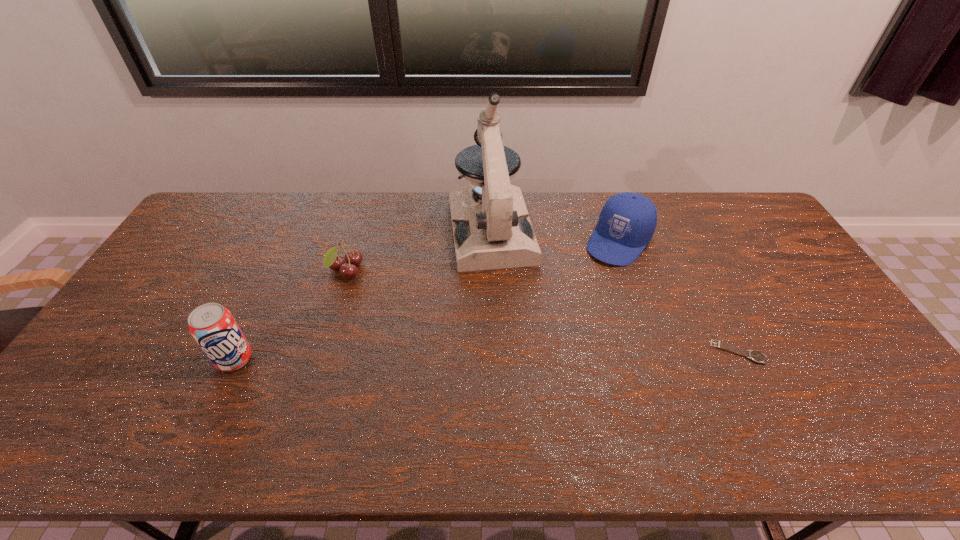
Locate which object is the closest to the fourth object from left to right. Please provide its 2D coordinates. Your answer should be formatted as a tuple, i.e. [(x, y)], where the tuple contains the x and y coordinates of a point satisfying the conditions above.

[(491, 226)]

Identify the location of vacant space that satisfies the following two spatial constraints: 1. on the front side of the cherry; 2. on the left side of the watch. The height and width of the screenshot is (540, 960). (321, 352).

At what (x,y) coordinates should I click in order to perform the action: click on free space that satisfies the following two spatial constraints: 1. on the back side of the leftmost object; 2. on the right side of the rightmost object. Please return your answer as a coordinate pair (x, y). Looking at the image, I should click on (238, 352).

Find the location of `vacant region that satisfies the following two spatial constraints: 1. on the back side of the rightmost object; 2. on the left side of the soda can`. vacant region that satisfies the following two spatial constraints: 1. on the back side of the rightmost object; 2. on the left side of the soda can is located at coordinates (238, 352).